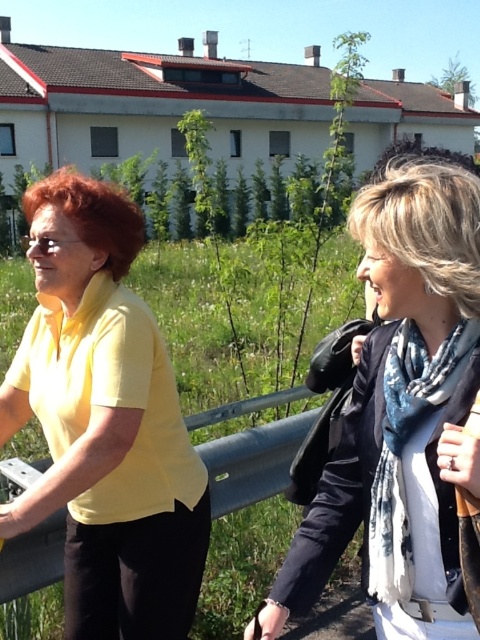
You are a photographer trying to capture both the white scarf at center and the blue printed scarf at right in a single shot. Which scarf should you focus on first to ensure both are in frame?

You should focus on the white scarf at center first because it is closer to the viewer than the blue printed scarf at right, so adjusting the camera to include the closer one ensures the farther one will also be in the frame.

You are a photographer trying to capture a photo of both the yellow matte shirt at left and the blue printed scarf at right in the scene. Since you want both subjects to be clearly visible, which one should you focus on first to ensure depth of field?

The yellow matte shirt at left is much taller than the blue printed scarf at right, so you should focus on the yellow matte shirt at left first to ensure both are in focus.